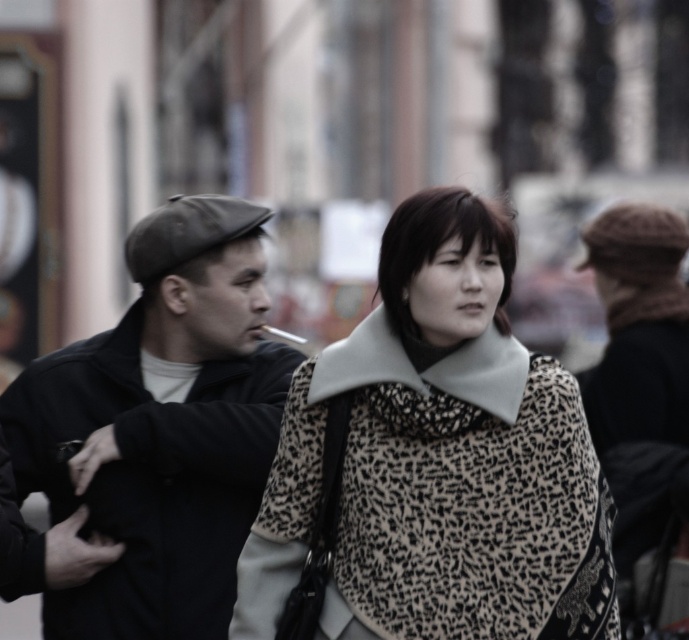
You are standing at the point closest to the camera. Which point, point (464, 589) or point (147, 618), is closer to you?

Point (464, 589) is in front of point (147, 618), so it is closer to you.

You are a fashion stylist preparing for a photoshoot. You have a leopard print scarf at center and a matte black jacket at left. Which item should you choose if you want to use the smaller accessory for a subtle look?

The leopard print scarf at center has a smaller size compared to the matte black jacket at left, so you should choose the leopard print scarf at center for a subtle look.

Based on the scene description, which object is shorter in height between the leopard print scarf at center and the matte black jacket at left?

The leopard print scarf at center has a lesser height compared to the matte black jacket at left, so the leopard print scarf at center is shorter in height.